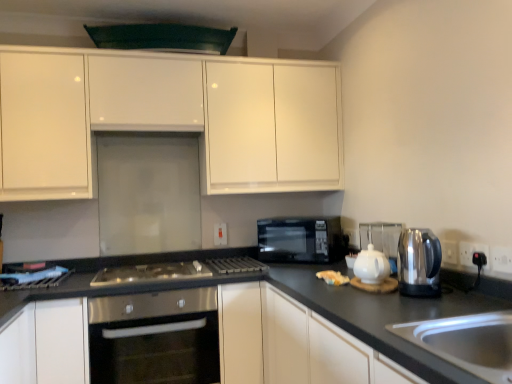
Question: Can you confirm if black matte countertop at lower right, the second cabinetry when ordered from top to bottom, is wider than stainless steel gas stove at center?

Choices:
 (A) no
 (B) yes

Answer: (B)

Question: Is black matte countertop at lower right, the second cabinetry when ordered from top to bottom, positioned in front of stainless steel gas stove at center?

Choices:
 (A) yes
 (B) no

Answer: (A)

Question: Is black matte countertop at lower right, the second cabinetry when ordered from top to bottom, facing away from stainless steel gas stove at center?

Choices:
 (A) yes
 (B) no

Answer: (B)

Question: Considering the relative sizes of black matte countertop at lower right, which is counted as the second cabinetry, starting from the bottom, and stainless steel gas stove at center in the image provided, is black matte countertop at lower right, which is counted as the second cabinetry, starting from the bottom, taller than stainless steel gas stove at center?

Choices:
 (A) no
 (B) yes

Answer: (B)

Question: Does black matte countertop at lower right, which is counted as the second cabinetry, starting from the bottom, appear on the right side of stainless steel gas stove at center?

Choices:
 (A) yes
 (B) no

Answer: (A)

Question: Can you confirm if black matte countertop at lower right, the second cabinetry when ordered from top to bottom, is thinner than stainless steel gas stove at center?

Choices:
 (A) no
 (B) yes

Answer: (A)

Question: Is stainless steel sink at lower right oriented away from black plastic electric outlet at lower right, the 2th electric outlet from the right?

Choices:
 (A) no
 (B) yes

Answer: (A)

Question: Is stainless steel sink at lower right not within black plastic electric outlet at lower right, placed as the 2th electric outlet when sorted from back to front?

Choices:
 (A) yes
 (B) no

Answer: (A)

Question: From a real-world perspective, is stainless steel sink at lower right on black plastic electric outlet at lower right, the 2th electric outlet from the right?

Choices:
 (A) no
 (B) yes

Answer: (A)

Question: Considering the relative sizes of stainless steel sink at lower right and black plastic electric outlet at lower right, the second electric outlet when ordered from front to back, in the image provided, is stainless steel sink at lower right taller than black plastic electric outlet at lower right, the second electric outlet when ordered from front to back,?

Choices:
 (A) no
 (B) yes

Answer: (B)

Question: Does stainless steel sink at lower right appear on the left side of black plastic electric outlet at lower right, which ranks as the 2th electric outlet in left-to-right order?

Choices:
 (A) no
 (B) yes

Answer: (B)

Question: Does stainless steel sink at lower right have a lesser width compared to black plastic electric outlet at lower right, placed as the 2th electric outlet when sorted from back to front?

Choices:
 (A) yes
 (B) no

Answer: (B)

Question: Considering the relative sizes of black plastic electric outlet at right, which is the third electric outlet from left to right, and white glossy teapot at center-right in the image provided, is black plastic electric outlet at right, which is the third electric outlet from left to right, wider than white glossy teapot at center-right?

Choices:
 (A) no
 (B) yes

Answer: (A)